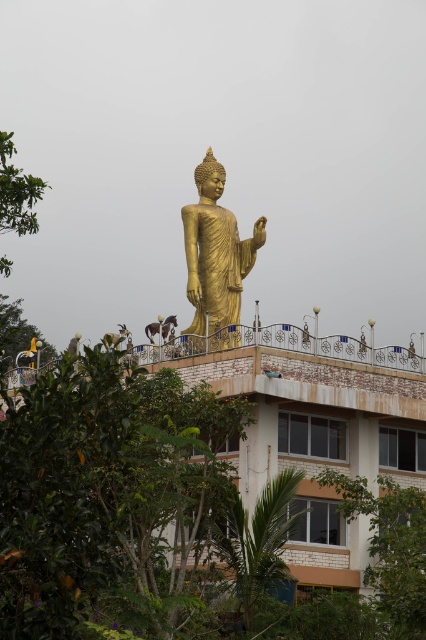
Question: Based on their relative distances, which object is farther from the gold polished statue at center?

Choices:
 (A) green leafy tree at lower right
 (B) green leafy tree at lower left
 (C) green leafy tree at lower center

Answer: (A)

Question: Which object is the farthest from the green leafy tree at lower left?

Choices:
 (A) green leafy tree at lower right
 (B) green leafy tree at left
 (C) green leafy tree at lower center

Answer: (A)

Question: Which object is farther from the camera taking this photo?

Choices:
 (A) green leafy tree at lower center
 (B) gold polished statue at center
 (C) green leafy tree at lower right
 (D) green leafy tree at lower left

Answer: (D)

Question: Is gold polished statue at center above green leafy tree at lower left?

Choices:
 (A) yes
 (B) no

Answer: (A)

Question: Does gold polished statue at center have a larger size compared to green leafy tree at left?

Choices:
 (A) yes
 (B) no

Answer: (B)

Question: Does green leafy tree at left appear on the left side of green leafy tree at lower left?

Choices:
 (A) no
 (B) yes

Answer: (A)